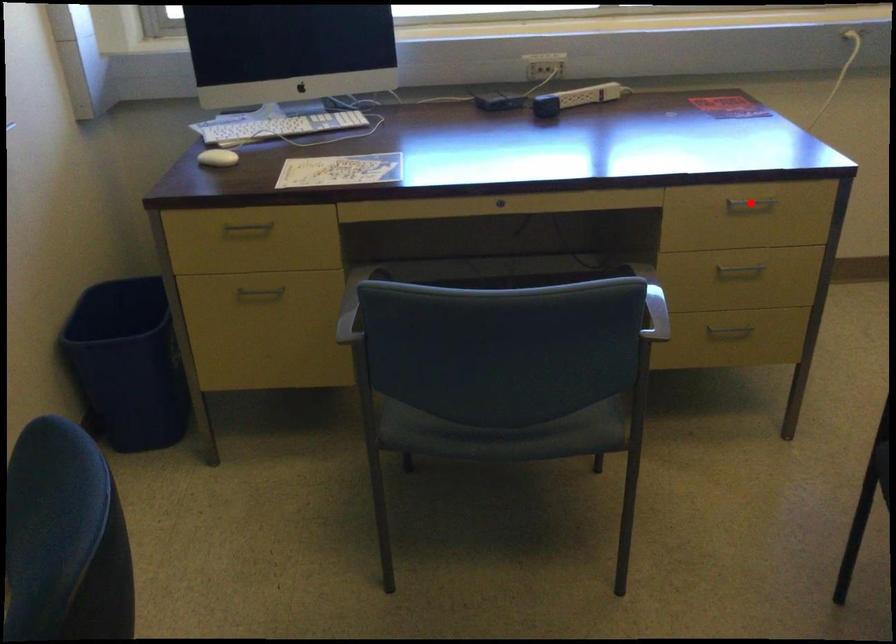
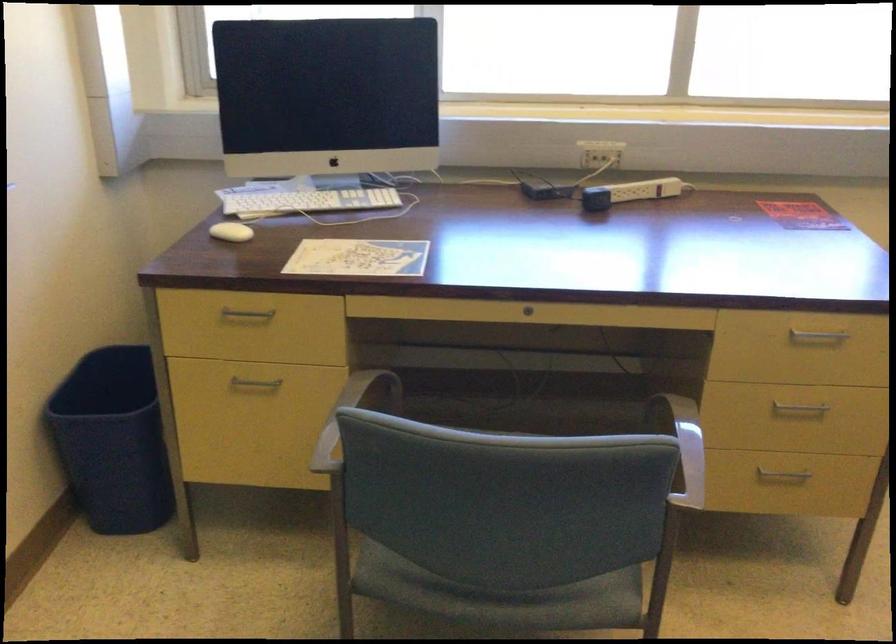
Question: I am providing you with two images of the same scene from different viewpoints. A red point is marked on the first image. At the location where the point appears in image 1, is it still visible in image 2?

Choices:
 (A) Yes
 (B) No

Answer: (A)